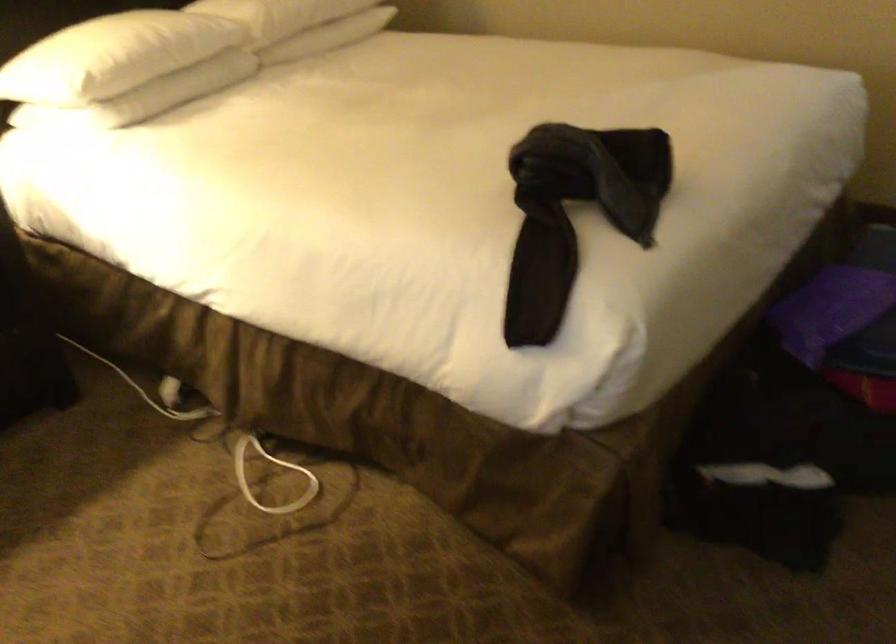
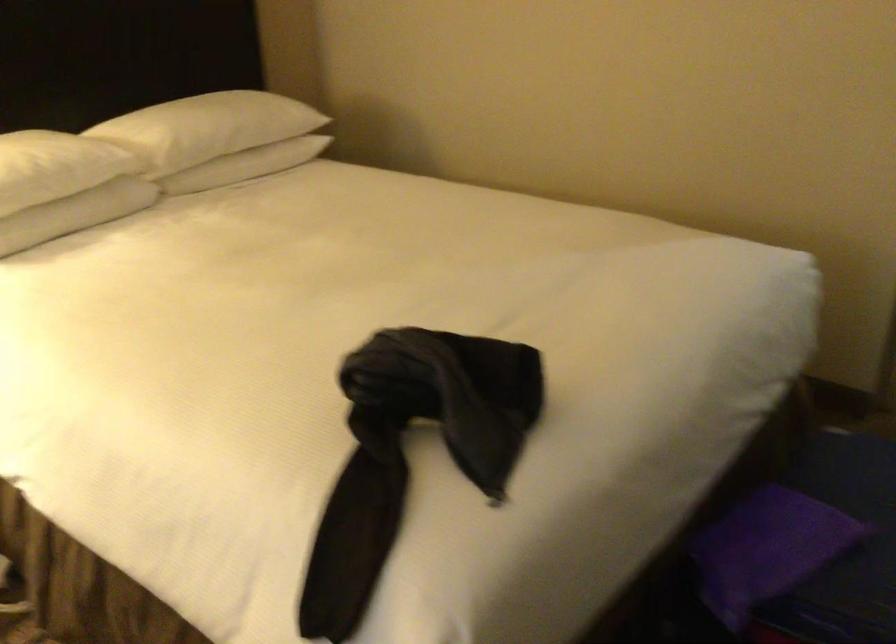
Question: The first image is from the beginning of the video and the second image is from the end. How did the camera likely rotate when shooting the video?

Choices:
 (A) Left
 (B) Right
 (C) Up
 (D) Down

Answer: (C)